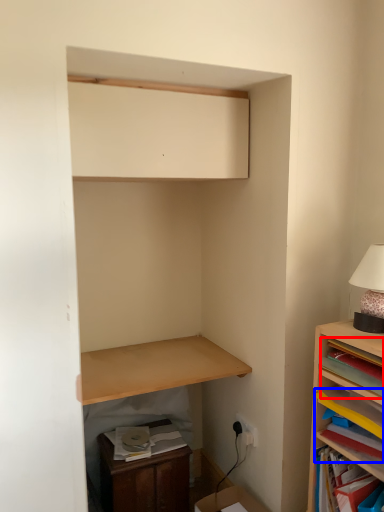
Question: Which point is further to the camera, book (highlighted by a red box) or book (highlighted by a blue box)?

Choices:
 (A) book
 (B) book

Answer: (B)